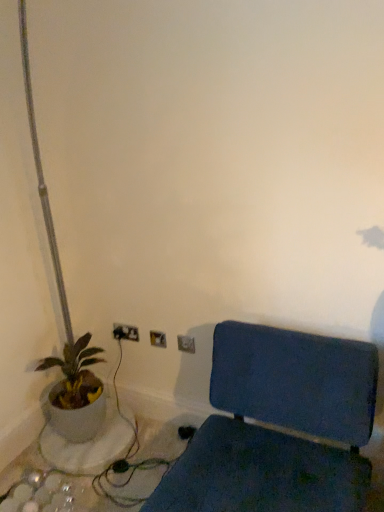
The height and width of the screenshot is (512, 384). I want to click on free spot to the right of matte white pot at left, so click(x=139, y=448).